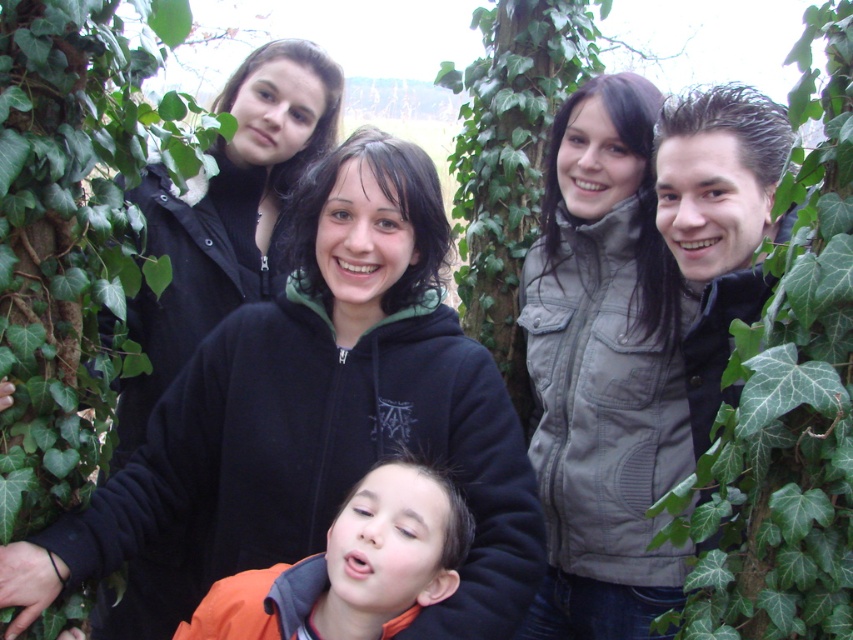
You are standing in the park and see two green leafy ivy plants. One is labeled as green leafy ivy at center and the other as green leafy ivy at upper right. Which ivy is positioned to the left when viewed from your perspective?

The green leafy ivy at center is positioned to the left of the green leafy ivy at upper right.

You are standing in the park and see two green leafy ivy plants in the image. Which one is closer to you, the green leafy ivy at center or the green leafy ivy at upper right?

The green leafy ivy at center is closer to you because it is further to the viewer than the green leafy ivy at upper right.

You are standing in the park and want to take a photo of the group while ensuring the green leafy ivy at upper right appears in the top right corner of your camera frame. According to the coordinates provided, is the ivy positioned correctly for this composition?

The green leafy ivy at upper right is located at coordinates (785, 397), which places it near the top right corner of the frame, making it suitable for the desired composition.